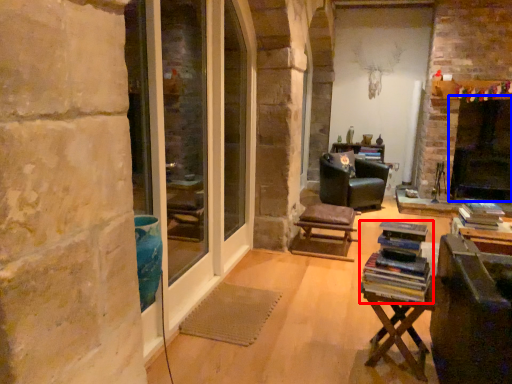
Question: Which object appears farthest to the camera in this image, book (highlighted by a red box) or fireplace (highlighted by a blue box)?

Choices:
 (A) book
 (B) fireplace

Answer: (B)